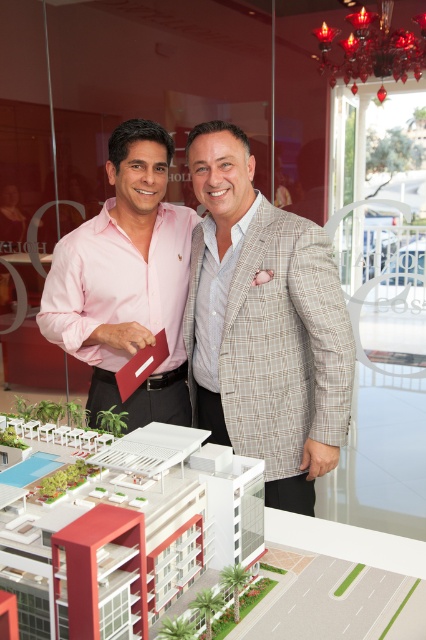
Question: Which point is farther from the camera taking this photo?

Choices:
 (A) (253, 372)
 (B) (118, 204)

Answer: (B)

Question: Which object is farther from the camera taking this photo?

Choices:
 (A) plaid wool blazer at center
 (B) pink cotton shirt at center

Answer: (B)

Question: In this image, where is plaid wool blazer at center located relative to pink cotton shirt at center?

Choices:
 (A) below
 (B) above

Answer: (A)

Question: Can you confirm if plaid wool blazer at center is wider than pink cotton shirt at center?

Choices:
 (A) yes
 (B) no

Answer: (B)

Question: Can you confirm if plaid wool blazer at center is smaller than pink cotton shirt at center?

Choices:
 (A) yes
 (B) no

Answer: (A)